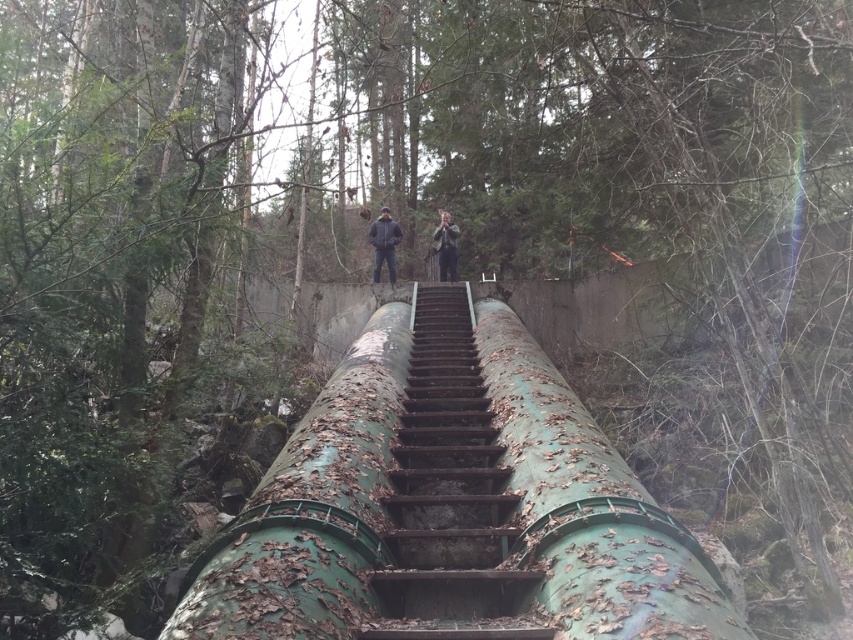
You are a maintenance worker needing to access the pipe for inspection. The green rusted water pipe at center and the dark gray jacket at center are both in your line of sight. Which object is wider from your perspective?

The green rusted water pipe at center might be wider than dark gray jacket at center according to the description.

You are a hiker who wants to cross the green mossy pipe at center. You are wearing a dark gray jacket at center. If you lay your jacket flat on the pipe, will it cover the entire length of the pipe?

The dark gray jacket at center is wider than the green mossy pipe at center, so when laid flat, the jacket will cover the entire length of the pipe.